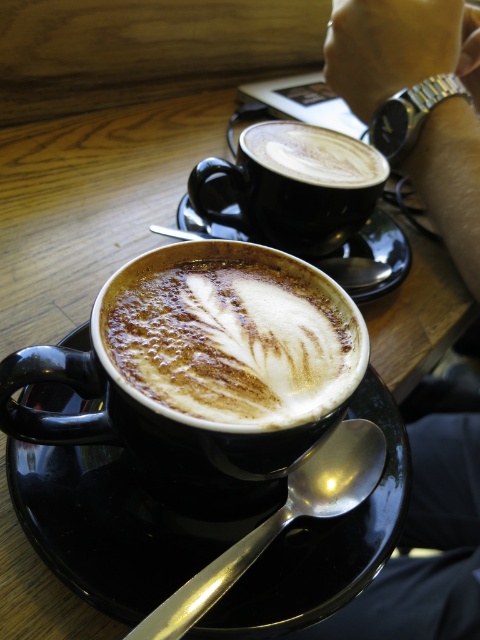
Question: Estimate the real-world distances between objects in this image. Which object is closer to the matte black cup at upper center?

Choices:
 (A) black ceramic saucer at center
 (B) silver metallic spoon at lower center
 (C) matte black cup at center

Answer: (C)

Question: Estimate the real-world distances between objects in this image. Which object is closer to the black ceramic saucer at center?

Choices:
 (A) matte black coffee cup at center
 (B) silver metallic spoon at lower center

Answer: (B)

Question: Is matte black coffee cup at center wider than matte black cup at center?

Choices:
 (A) yes
 (B) no

Answer: (B)

Question: Is black ceramic saucer at center bigger than matte black cup at center?

Choices:
 (A) yes
 (B) no

Answer: (A)

Question: Does matte black coffee cup at center appear on the left side of matte black cup at center?

Choices:
 (A) no
 (B) yes

Answer: (B)

Question: Which of these objects is positioned farthest from the matte black cup at upper center?

Choices:
 (A) black matte saucer at center
 (B) matte black cup at center
 (C) matte black coffee cup at center

Answer: (C)